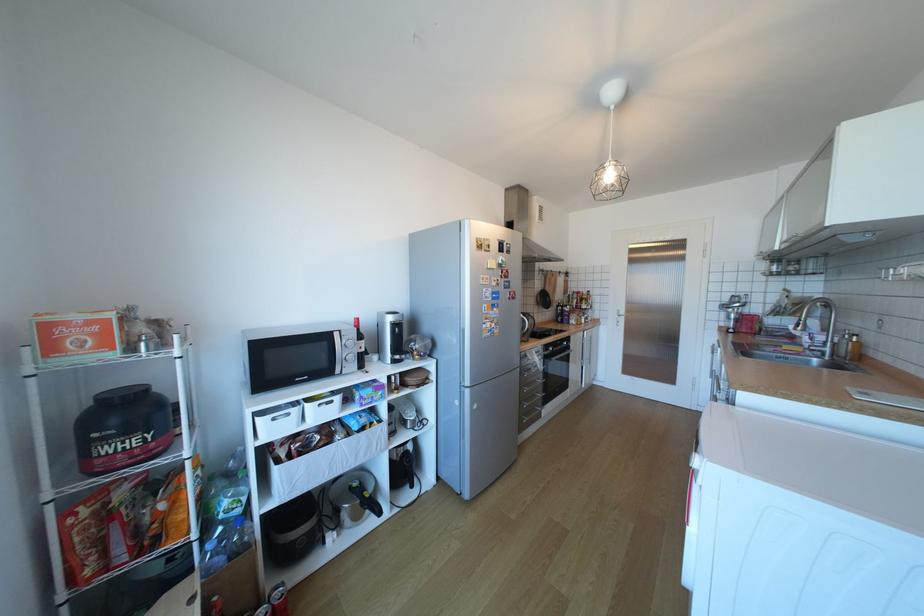
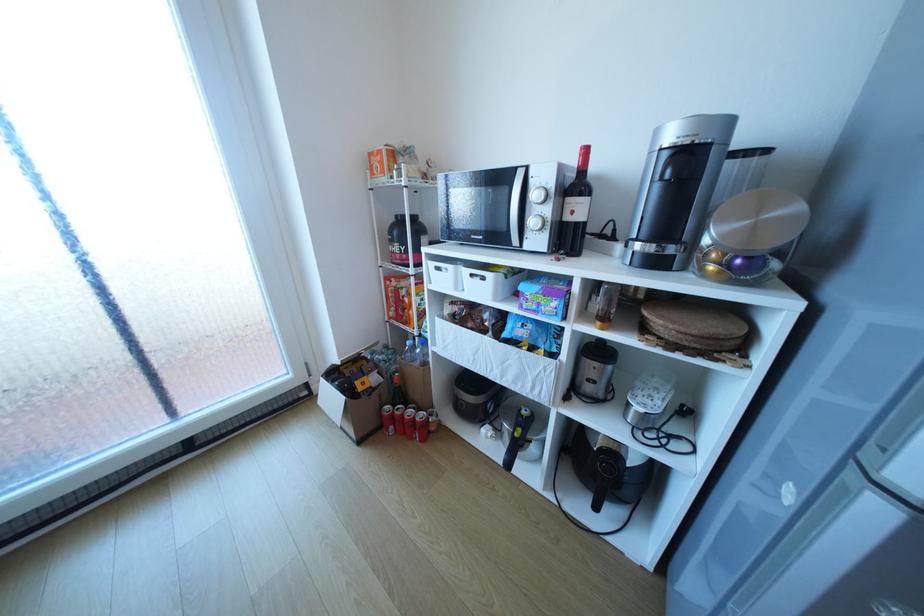
In the second image, find the point that corresponds to (x=417, y=487) in the first image.

(599, 499)